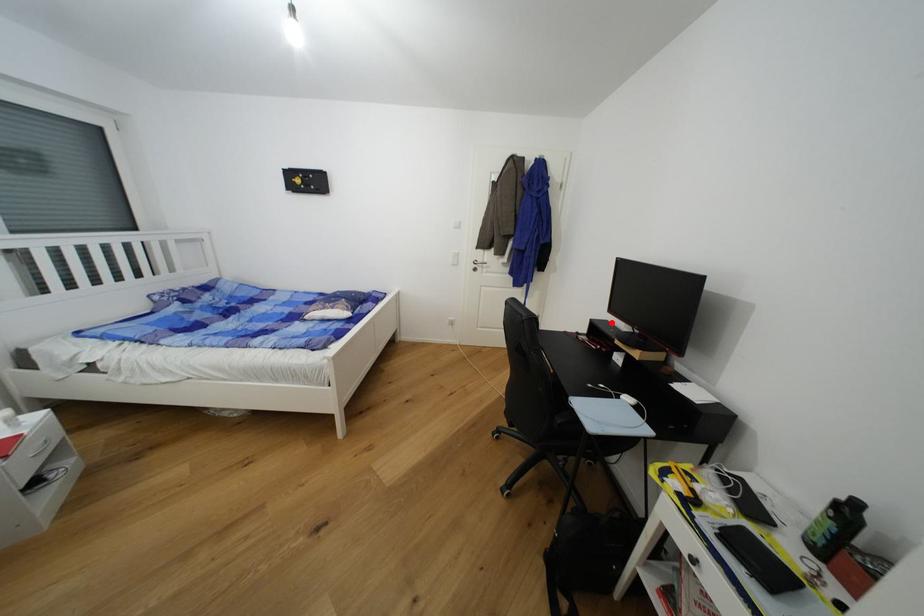
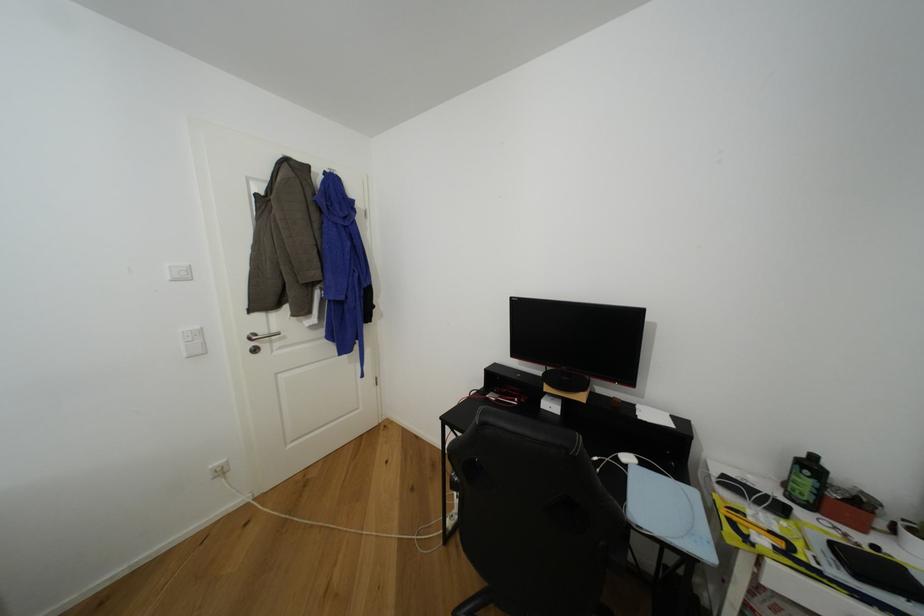
Question: I am providing you with two images of the same scene from different viewpoints. A red point is shown in image1. For the corresponding object point in image2, is it positioned nearer or farther from the camera?

Choices:
 (A) Nearer
 (B) Farther

Answer: (B)